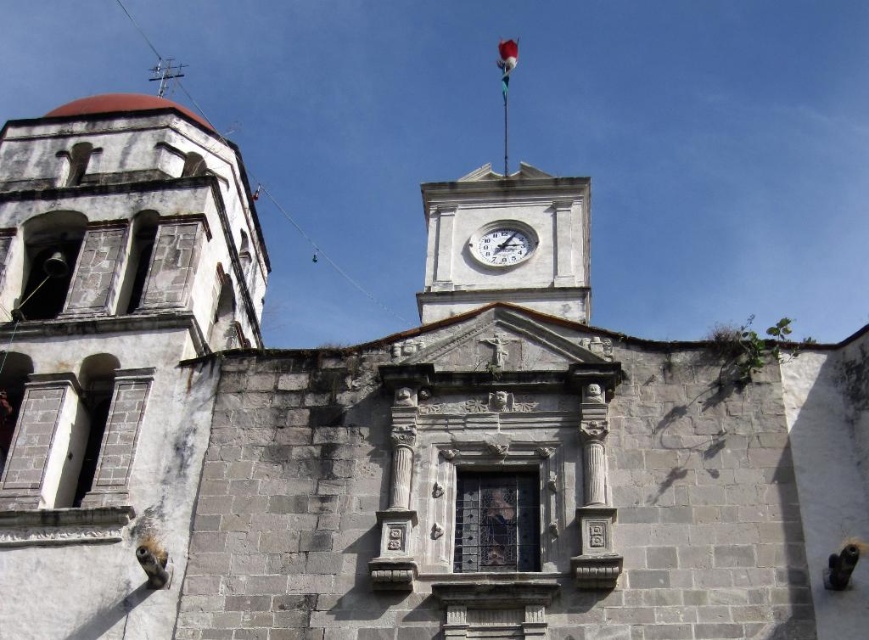
Question: Can you confirm if white stone clock tower at upper center is positioned below white glossy clock at upper center?

Choices:
 (A) yes
 (B) no

Answer: (B)

Question: Is white stone clock tower at upper center to the left of white glossy clock at upper center from the viewer's perspective?

Choices:
 (A) yes
 (B) no

Answer: (B)

Question: Can you confirm if white stone clock tower at upper center is thinner than white glossy clock at upper center?

Choices:
 (A) no
 (B) yes

Answer: (A)